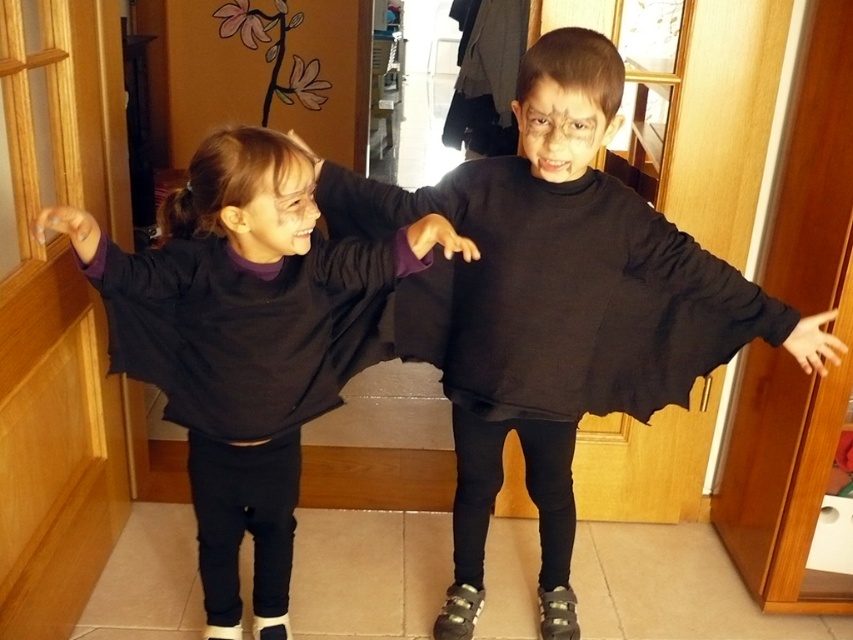
Based on the scene description, which object is positioned higher between the black matte sweater at center and the matte black sweater at center?

The black matte sweater at center is positioned higher than the matte black sweater at center.

You are a photographer trying to capture a clear photo of both the black matte sweater at center and the matte black sweater at center. However, one of them is blocking the view of the other. Which sweater should you adjust to get both in focus?

The matte black sweater at center is behind the black matte sweater at center, so you should adjust the matte black sweater at center to move it forward to avoid blocking the view.

You are a tailor measuring two sweaters in the image to determine if they can fit side by side on a 28 inch wide display shelf. The sweaters are the black matte sweater at center and the matte black sweater at center. Can both sweaters fit on the shelf without overlapping?

The black matte sweater at center is 14.38 inches away from matte black sweater at center, so the total width required would be 14.38 inches. Since the shelf is 28 inches wide, both sweaters can fit side by side without overlapping.